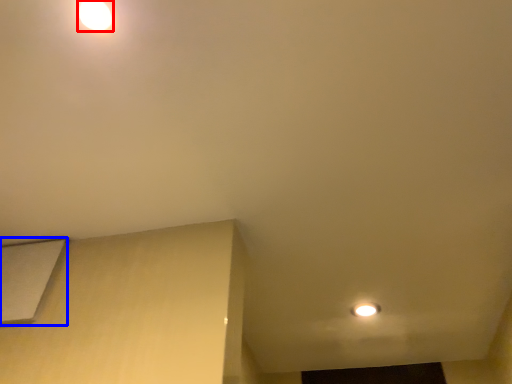
Question: Among these objects, which one is nearest to the camera, lamp (highlighted by a red box) or lift (highlighted by a blue box)?

Choices:
 (A) lamp
 (B) lift

Answer: (A)